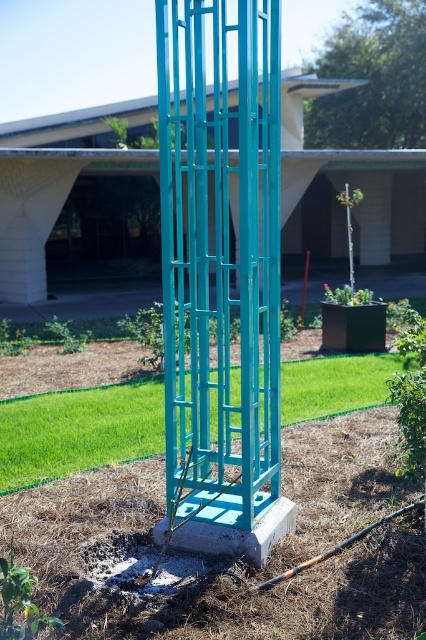
You are standing in the landscaped area and want to place a small potted plant between the teal metal trellis at center and the green grass at center. Based on their positions, where should you place the potted plant?

The teal metal trellis at center is above the green grass at center, so you should place the potted plant on the green grass at center, which is below the teal metal trellis at center.

Consider the image. You are standing in the landscaped area and want to walk from the teal metal trellis at center to the green grass at center. Which direction should you move?

You should move to the right since the teal metal trellis at center is to the left of the green grass at center.